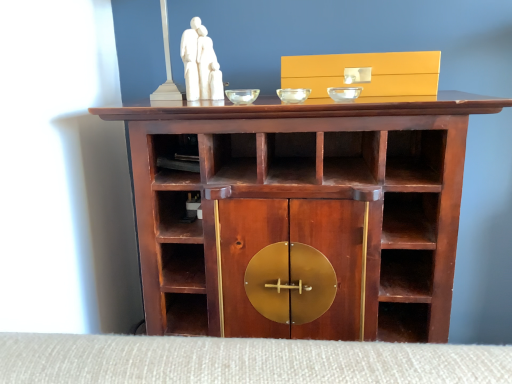
Question: Should I look upward or downward to see transparent glass bowl at center, positioned as the second glass bowl in right-to-left order?

Choices:
 (A) up
 (B) down

Answer: (A)

Question: Is matte gold drawer at upper center facing towards transparent glass bowl at center, which ranks as the 3th glass bowl in left-to-right order?

Choices:
 (A) yes
 (B) no

Answer: (A)

Question: Can you confirm if matte gold drawer at upper center is taller than transparent glass bowl at center, which ranks as the 3th glass bowl in left-to-right order?

Choices:
 (A) no
 (B) yes

Answer: (B)

Question: Is matte gold drawer at upper center outside transparent glass bowl at center, acting as the first glass bowl starting from the right?

Choices:
 (A) no
 (B) yes

Answer: (B)

Question: Can you confirm if matte gold drawer at upper center is thinner than transparent glass bowl at center, which ranks as the 3th glass bowl in left-to-right order?

Choices:
 (A) yes
 (B) no

Answer: (B)

Question: From the image's perspective, does matte gold drawer at upper center appear higher than transparent glass bowl at center, acting as the first glass bowl starting from the right?

Choices:
 (A) yes
 (B) no

Answer: (A)

Question: Considering the relative sizes of matte gold drawer at upper center and transparent glass bowl at center, acting as the first glass bowl starting from the right, in the image provided, is matte gold drawer at upper center wider than transparent glass bowl at center, acting as the first glass bowl starting from the right,?

Choices:
 (A) yes
 (B) no

Answer: (A)

Question: Considering the relative positions of matte gold drawer at upper center and mahogany wood cabinet at center in the image provided, is matte gold drawer at upper center to the right of mahogany wood cabinet at center from the viewer's perspective?

Choices:
 (A) no
 (B) yes

Answer: (B)

Question: Is matte gold drawer at upper center turned away from mahogany wood cabinet at center?

Choices:
 (A) yes
 (B) no

Answer: (B)

Question: From a real-world perspective, is matte gold drawer at upper center located higher than mahogany wood cabinet at center?

Choices:
 (A) yes
 (B) no

Answer: (A)

Question: Is matte gold drawer at upper center behind mahogany wood cabinet at center?

Choices:
 (A) no
 (B) yes

Answer: (B)

Question: Can you confirm if matte gold drawer at upper center is shorter than mahogany wood cabinet at center?

Choices:
 (A) no
 (B) yes

Answer: (B)

Question: Is matte gold drawer at upper center not within mahogany wood cabinet at center?

Choices:
 (A) no
 (B) yes

Answer: (B)

Question: Does mahogany wood cabinet at center turn towards white marble sculpture at upper center?

Choices:
 (A) no
 (B) yes

Answer: (A)